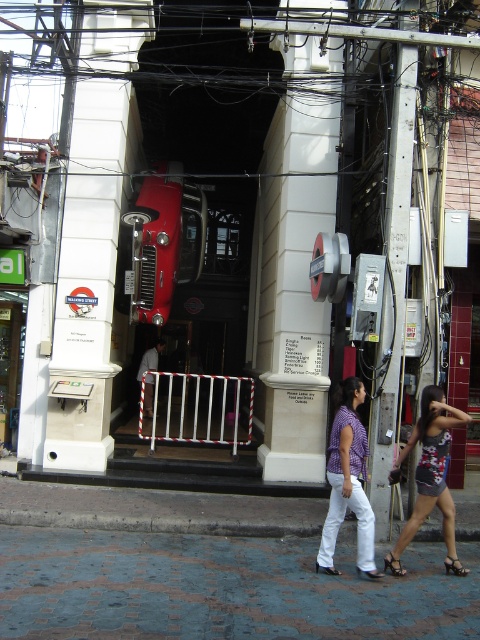
Question: Which object appears closest to the camera in this image?

Choices:
 (A) white concrete pillar at center
 (B) black patent leather sandal at lower right

Answer: (B)

Question: Is shiny black sandal at lower right below black leather sandal at lower center?

Choices:
 (A) no
 (B) yes

Answer: (B)

Question: Which point is farther to the camera?

Choices:
 (A) (363, 576)
 (B) (254, 285)
 (C) (319, 570)

Answer: (B)

Question: Is white stone pillar at center wider than purple printed blouse at center?

Choices:
 (A) no
 (B) yes

Answer: (B)

Question: Can you confirm if purple printed blouse at center is wider than light gray fabric pants at center?

Choices:
 (A) no
 (B) yes

Answer: (A)

Question: Which point is farther to the camera?

Choices:
 (A) (312, 163)
 (B) (384, 566)
 (C) (384, 506)
 (D) (411, 516)

Answer: (A)